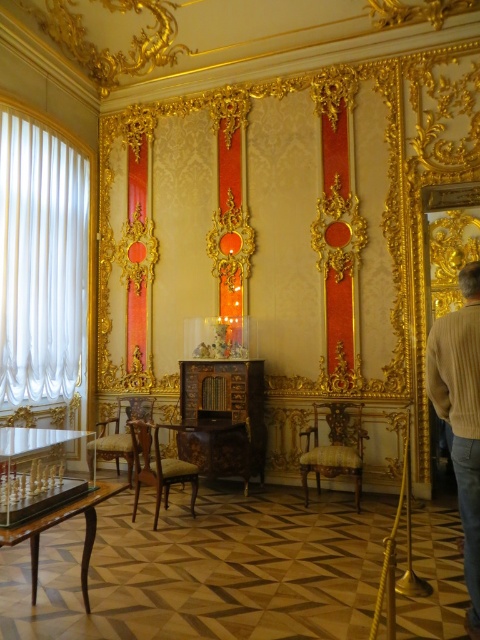
You are a decorator planning to place a new table between the gold upholstered chair at center and the light brown wood chair at center. The table must be at least 5 feet long to accommodate a centerpiece. Can the table fit between them?

The gold upholstered chair at center is 7.09 feet away from the light brown wood chair at center. Since the required table length is 5 feet, the distance between them is sufficient, so the table can fit between them.

You are standing in the center of the room and see both the gold upholstered chair at center and the light brown wood chair at center. Which chair is positioned to the right when facing the chairs from the center of the room?

The gold upholstered chair at center is positioned to the right of the light brown wood chair at center when facing them from the center of the room.